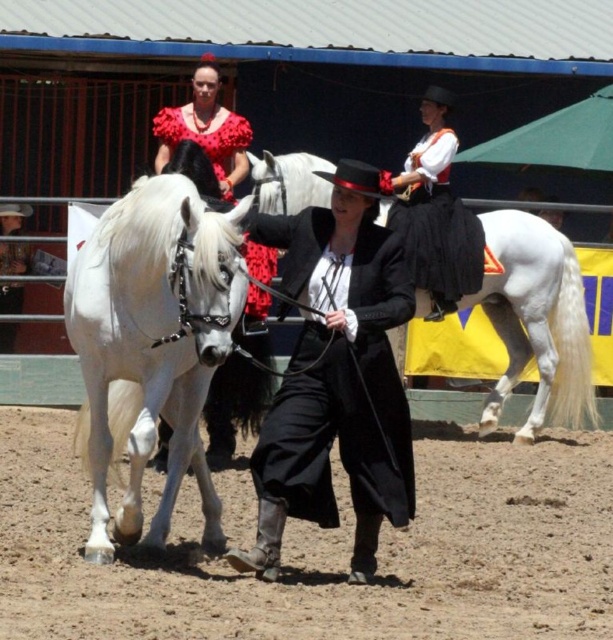
Question: Can you confirm if black matte coat at center is smaller than matte black dress at center?

Choices:
 (A) yes
 (B) no

Answer: (A)

Question: In this image, where is brown sandy dirt at lower center located relative to floral fabric dress at upper center?

Choices:
 (A) below
 (B) above

Answer: (A)

Question: Which point appears farthest from the camera in this image?

Choices:
 (A) (403, 403)
 (B) (223, 134)
 (C) (522, 308)
 (D) (211, 428)

Answer: (C)

Question: Does white glossy horse at left have a greater width compared to black matte coat at center?

Choices:
 (A) no
 (B) yes

Answer: (B)

Question: Which point appears closest to the camera in this image?

Choices:
 (A) (223, 256)
 (B) (227, 147)
 (C) (579, 314)
 (D) (413, 488)

Answer: (A)

Question: Among these objects, which one is nearest to the camera?

Choices:
 (A) matte black dress at center
 (B) brown sandy dirt at lower center
 (C) white glossy horse at center
 (D) black matte coat at center

Answer: (B)